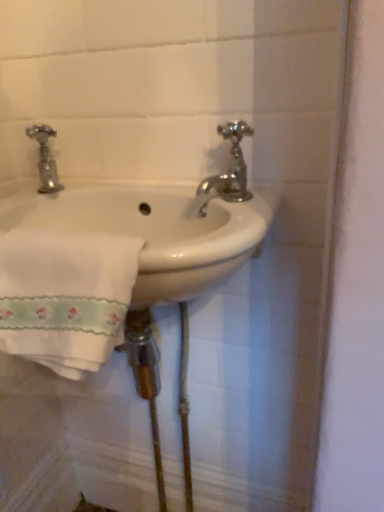
Question: Is white ceramic sink at center in front of or behind polished chrome faucet at upper right in the image?

Choices:
 (A) front
 (B) behind

Answer: (A)

Question: Considering the positions of white ceramic sink at center and polished chrome faucet at upper right in the image, is white ceramic sink at center bigger or smaller than polished chrome faucet at upper right?

Choices:
 (A) small
 (B) big

Answer: (B)

Question: Which object is positioned farthest from the white ceramic sink at center?

Choices:
 (A) polished chrome faucet at upper right
 (B) white embroidered towel at lower left

Answer: (B)

Question: Which is farther from the polished chrome faucet at upper right?

Choices:
 (A) white embroidered towel at lower left
 (B) white ceramic sink at center

Answer: (A)